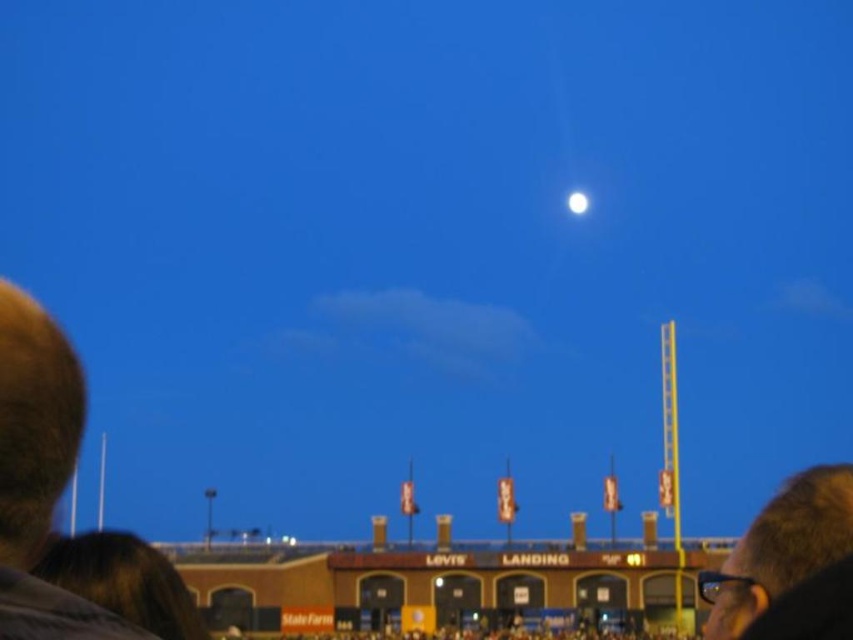
Is brown hair at left below dark brown hair at upper right?

Actually, brown hair at left is above dark brown hair at upper right.

Between brown hair at left and dark brown hair at upper right, which one appears on the right side from the viewer's perspective?

dark brown hair at upper right

Who is more distant from viewer, (10, 609) or (814, 518)?

Positioned behind is point (814, 518).

Where is `brown hair at left`? The height and width of the screenshot is (640, 853). brown hair at left is located at coordinates (39, 474).

This screenshot has width=853, height=640. What do you see at coordinates (780, 548) in the screenshot?
I see `dark brown hair at upper right` at bounding box center [780, 548].

Between point (782, 540) and point (584, 200), which one is positioned in front?

Positioned in front is point (782, 540).

In order to click on dark brown hair at upper right in this screenshot , I will do `click(780, 548)`.

Does brown hair at left have a smaller size compared to bright white sphere at upper center?

No.

Is brown hair at left further to the viewer compared to bright white sphere at upper center?

No, it is not.

The height and width of the screenshot is (640, 853). I want to click on brown hair at left, so click(x=39, y=474).